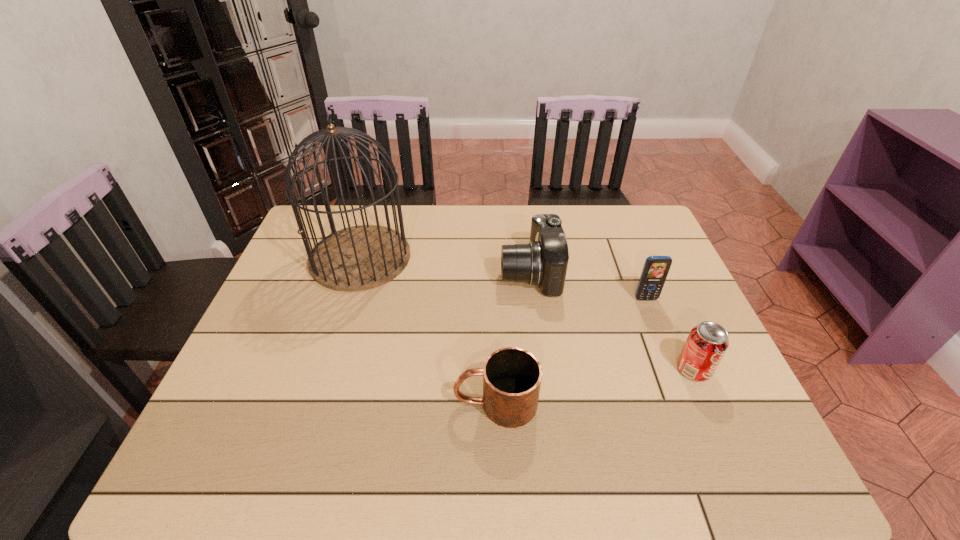
Identify the location of free space located 0.230m on the lens of the camera. This screenshot has width=960, height=540. (420, 272).

I want to click on free location located on the back of the soda can, so click(x=660, y=291).

Find the location of a particular element. free space located 0.290m on the side of the mug with the handle is located at coordinates (319, 403).

Find the location of a particular element. vacant space situated on the side of the mug with the handle is located at coordinates (338, 403).

Locate an element on the screen. This screenshot has height=540, width=960. free spot located 0.340m on the side of the mug with the handle is located at coordinates (296, 403).

Image resolution: width=960 pixels, height=540 pixels. Identify the location of birdcage present at the far edge. (358, 258).

The height and width of the screenshot is (540, 960). I want to click on camera that is at the far edge, so click(544, 261).

Locate an element on the screen. The width and height of the screenshot is (960, 540). object located in the left edge section of the desktop is located at coordinates (358, 258).

You are a GUI agent. You are given a task and a screenshot of the screen. Output one action in this format:
    pyautogui.click(x=<x>, y=<y>)
    Task: Click on the cellular telephone present at the right edge
    This screenshot has height=540, width=960.
    Given the screenshot: What is the action you would take?
    (x=656, y=268)

Locate an element on the screen. soda can that is positioned at the right edge is located at coordinates (707, 342).